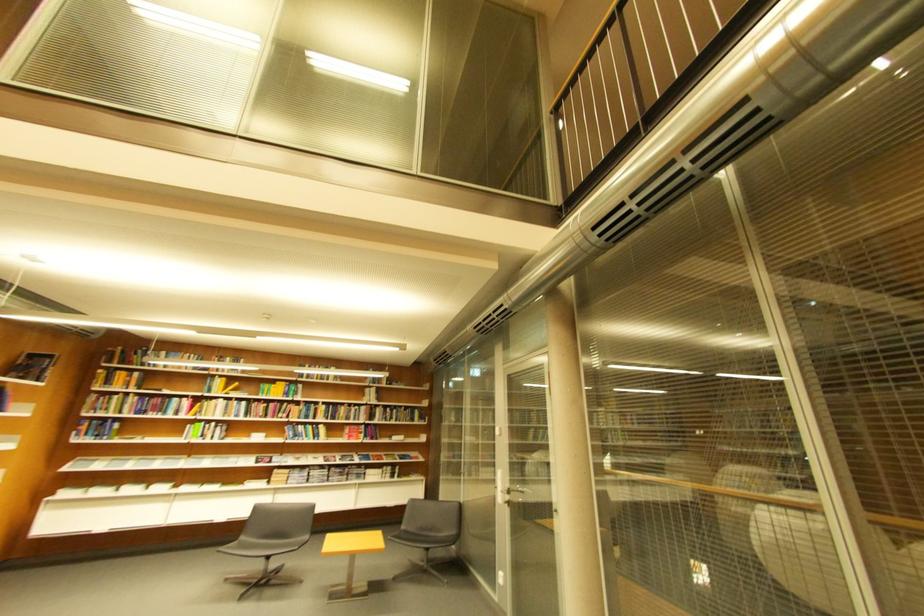
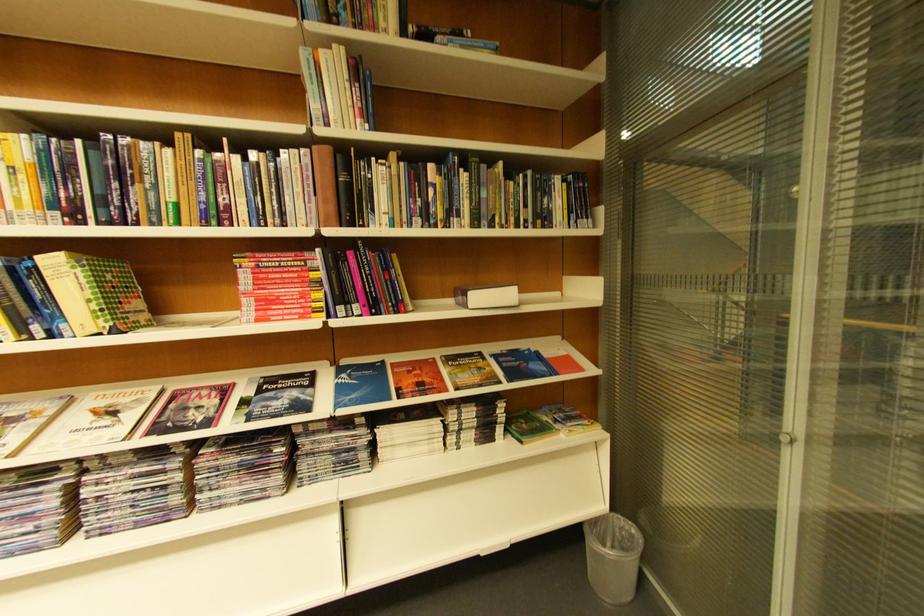
In the second image, find the point that corresponds to (332,428) in the first image.

(63, 264)